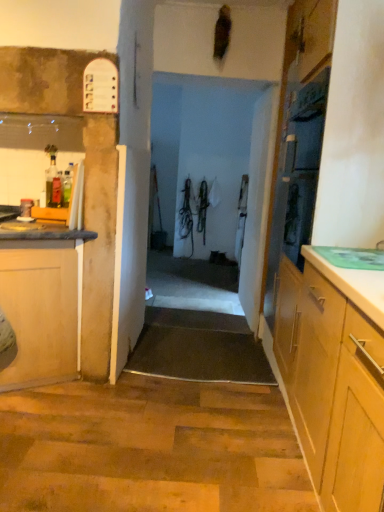
Question: Would you say wooden cabinet at left is to the left or to the right of white matte door at center in the picture?

Choices:
 (A) left
 (B) right

Answer: (A)

Question: Is wooden cabinet at left inside the boundaries of white matte door at center, or outside?

Choices:
 (A) inside
 (B) outside

Answer: (B)

Question: Is point (59, 250) positioned closer to the camera than point (142, 283)?

Choices:
 (A) closer
 (B) farther

Answer: (A)

Question: Is white matte door at center to the left or to the right of wooden cabinet at left in the image?

Choices:
 (A) left
 (B) right

Answer: (B)

Question: In terms of height, does white matte door at center look taller or shorter compared to wooden cabinet at left?

Choices:
 (A) tall
 (B) short

Answer: (A)

Question: In terms of size, does white matte door at center appear bigger or smaller than wooden cabinet at left?

Choices:
 (A) small
 (B) big

Answer: (A)

Question: From a real-world perspective, is white matte door at center physically located above or below wooden cabinet at left?

Choices:
 (A) below
 (B) above

Answer: (B)